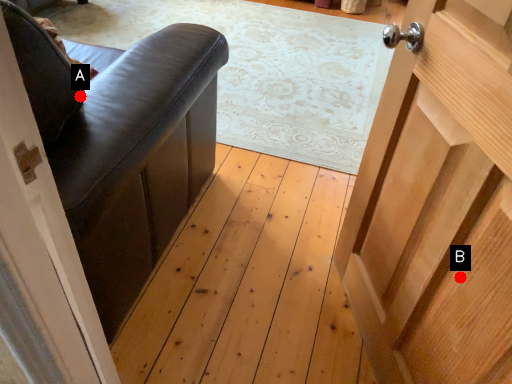
Question: Two points are circled on the image, labeled by A and B beside each circle. Which point appears closest to the camera in this image?

Choices:
 (A) A is closer
 (B) B is closer

Answer: (B)